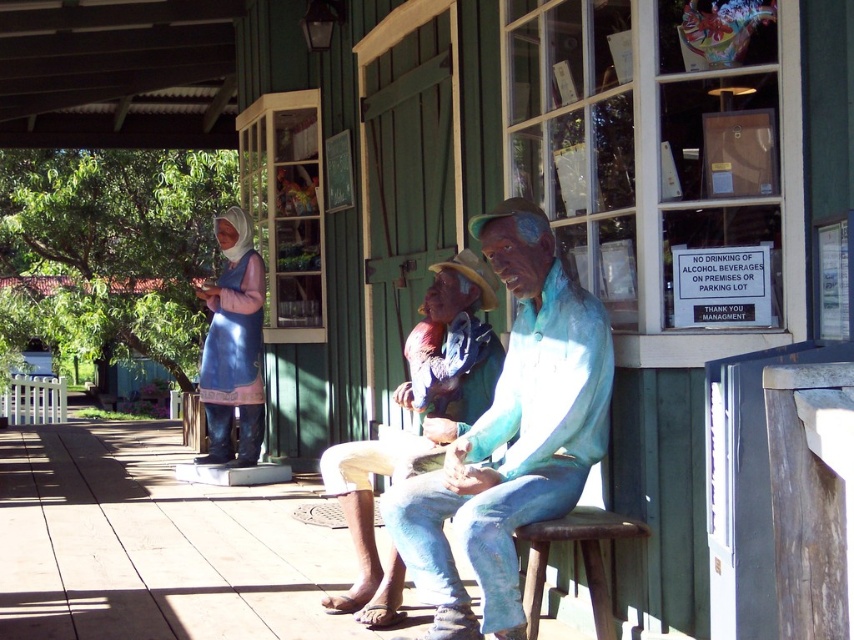
You are standing in front of the building and want to take a photo of both point (601, 358) and point (445, 420). Which point will appear larger in your photo?

Point (601, 358) is closer to the camera than point (445, 420), so it will appear larger in the photo.

You are standing in front of the building and want to take a photo that includes both the point at (499, 257) and the point at (541, 548). Which point should be closer to the camera in your photo?

The point at (499, 257) should be closer to the camera in your photo because it is further to the camera than the point at (541, 548).

You are standing in front of the building and want to place a small potted plant between the matte blue statue at center and the rustic wood stool at lower right. Based on their positions, which object should the plant be closer to?

The matte blue statue at center is closer to the viewer than the rustic wood stool at lower right, so the plant should be placed closer to the rustic wood stool at lower right to maintain equal distance between both objects.